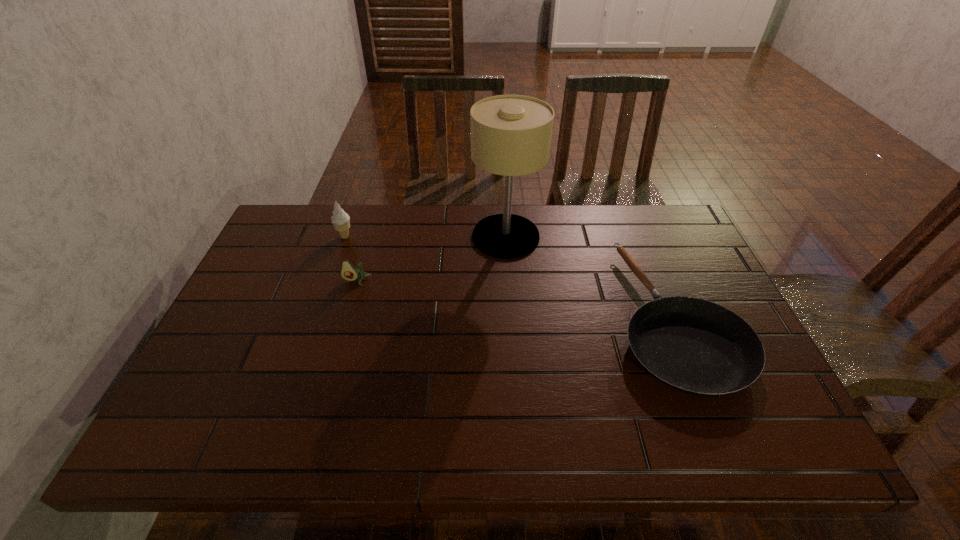
At what (x,y) coordinates should I click in order to perform the action: click on free point between the shortest object and the icecream. Please return your answer as a coordinate pair (x, y). The image size is (960, 540). Looking at the image, I should click on (510, 277).

Locate an element on the screen. object that is the closest to the avocado is located at coordinates (341, 221).

This screenshot has height=540, width=960. In order to click on object that can be found as the second closest to the shortest object in this screenshot , I will do `click(348, 272)`.

Identify the location of free location that satisfies the following two spatial constraints: 1. on the seed side of the avocado; 2. on the left side of the rightmost object. (346, 317).

At what (x,y) coordinates should I click in order to perform the action: click on free location that satisfies the following two spatial constraints: 1. on the front-facing side of the third shortest object; 2. on the back side of the frying pan. Please return your answer as a coordinate pair (x, y). This screenshot has height=540, width=960. Looking at the image, I should click on (317, 317).

Find the location of `free spot that satisfies the following two spatial constraints: 1. on the front-facing side of the icecream; 2. on the left side of the frying pan`. free spot that satisfies the following two spatial constraints: 1. on the front-facing side of the icecream; 2. on the left side of the frying pan is located at coordinates (317, 317).

I want to click on vacant area in the image that satisfies the following two spatial constraints: 1. on the back side of the frying pan; 2. on the front-facing side of the icecream, so click(640, 237).

In order to click on free region that satisfies the following two spatial constraints: 1. on the front-facing side of the icecream; 2. on the back side of the shortest object in this screenshot , I will do `click(317, 317)`.

Where is `vacant space that satisfies the following two spatial constraints: 1. on the front-facing side of the second tallest object; 2. on the right side of the third object from left to right`? The image size is (960, 540). vacant space that satisfies the following two spatial constraints: 1. on the front-facing side of the second tallest object; 2. on the right side of the third object from left to right is located at coordinates (345, 237).

The width and height of the screenshot is (960, 540). Identify the location of vacant space that satisfies the following two spatial constraints: 1. on the front-facing side of the second object from right to left; 2. on the left side of the leftmost object. (345, 237).